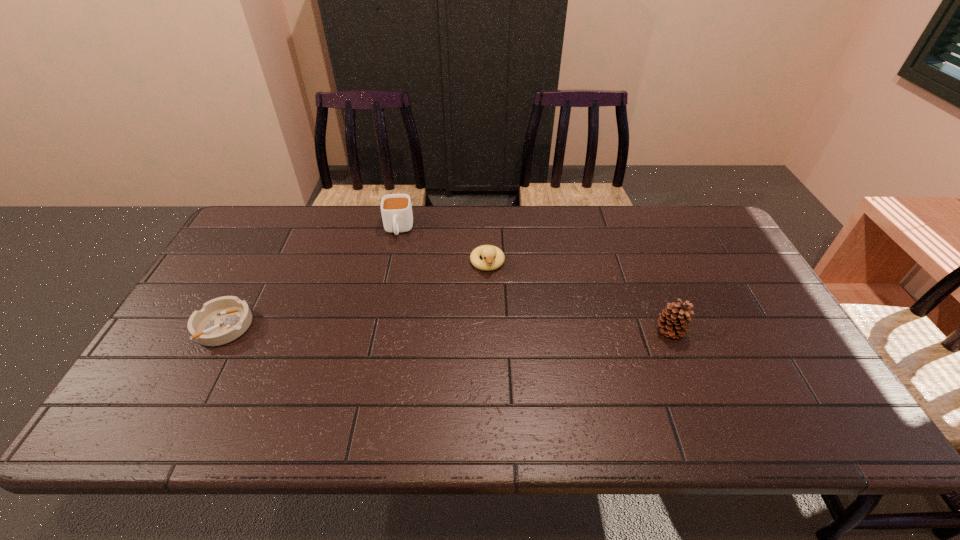
This screenshot has height=540, width=960. I want to click on vacant space positioned on the side with the handle of the farthest object, so click(389, 329).

Identify the location of vacant space located 0.180m on the side with the handle of the farthest object. The width and height of the screenshot is (960, 540). (393, 284).

This screenshot has height=540, width=960. Find the location of `free spot located 0.110m on the side with the handle of the farthest object`. free spot located 0.110m on the side with the handle of the farthest object is located at coordinates (395, 267).

At what (x,y) coordinates should I click in order to perform the action: click on free space located 0.210m at the beak of the second object from right to left. Please return your answer as a coordinate pair (x, y). This screenshot has height=540, width=960. Looking at the image, I should click on (499, 332).

The image size is (960, 540). I want to click on free point located 0.230m at the beak of the second object from right to left, so click(x=500, y=338).

Where is `free spot located 0.390m at the beak of the second object from right to left`? This screenshot has width=960, height=540. free spot located 0.390m at the beak of the second object from right to left is located at coordinates (510, 393).

Locate an element on the screen. Image resolution: width=960 pixels, height=540 pixels. object positioned at the far edge is located at coordinates (396, 209).

Where is `object at the left edge`? object at the left edge is located at coordinates (221, 320).

The image size is (960, 540). Identify the location of free space at the far edge of the desktop. (522, 207).

Where is `blank space at the near edge`? blank space at the near edge is located at coordinates (267, 373).